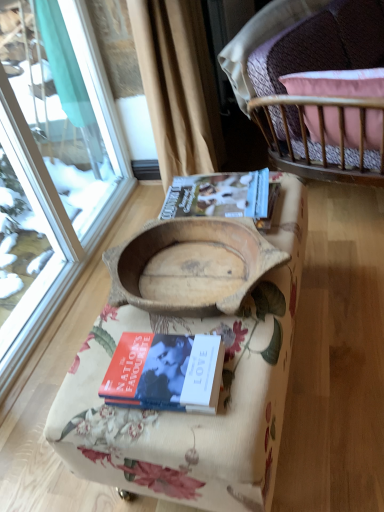
What is the approximate height of wooden cradle at center?

3.04 inches.

What is the approximate width of wooden bowl at center?

It is 17.95 inches.

This screenshot has height=512, width=384. What do you see at coordinates (165, 372) in the screenshot?
I see `hardcover book at center, the first book in the front-to-back sequence` at bounding box center [165, 372].

Image resolution: width=384 pixels, height=512 pixels. Identify the location of wooden cradle at center. (188, 241).

Who is more distant, wooden cradle at center or matte brown book at center, acting as the first book starting from the top?

matte brown book at center, acting as the first book starting from the top, is further from the camera.

Based on the photo, would you say wooden cradle at center is to the left or to the right of matte brown book at center, positioned as the 2th book in front-to-back order, in the picture?

From the image, it's evident that wooden cradle at center is to the left of matte brown book at center, positioned as the 2th book in front-to-back order.

Does wooden cradle at center have a larger size compared to matte brown book at center, which ranks as the 1th book in back-to-front order?

Yes.

Find the location of a particular element. The image size is (384, 512). infant bed behind the hardcover book at center, which is the first book from bottom to top is located at coordinates (188, 241).

Is hardcover book at center, which is the first book from bottom to top, wider or thinner than wooden cradle at center?

hardcover book at center, which is the first book from bottom to top, is thinner than wooden cradle at center.

From the image's perspective, which is below, hardcover book at center, the first book in the front-to-back sequence, or wooden cradle at center?

hardcover book at center, the first book in the front-to-back sequence, appears lower in the image.

Which of these two, wooden cradle at center or hardcover book at center, marked as the 2th book in a top-to-bottom arrangement, is smaller?

hardcover book at center, marked as the 2th book in a top-to-bottom arrangement, is smaller.

Is wooden cradle at center in contact with hardcover book at center, the first book in the front-to-back sequence?

wooden cradle at center and hardcover book at center, the first book in the front-to-back sequence, are clearly separated.

From a real-world perspective, which object rests below the other?

In real-world perspective, hardcover book at center, which is the first book from bottom to top, is lower.

Is wooden cradle at center outside of hardcover book at center, arranged as the second book when viewed from the back?

wooden cradle at center lies outside hardcover book at center, arranged as the second book when viewed from the back,'s area.

From the image's perspective, which object appears higher, matte brown book at center, which ranks as the 1th book in back-to-front order, or wooden cradle at center?

matte brown book at center, which ranks as the 1th book in back-to-front order, appears higher in the image.

Between matte brown book at center, acting as the first book starting from the top, and wooden cradle at center, which one has larger size?

Bigger between the two is wooden cradle at center.

Would you say wooden cradle at center is part of matte brown book at center, which ranks as the 1th book in back-to-front order,'s contents?

Definitely not — wooden cradle at center is not inside matte brown book at center, which ranks as the 1th book in back-to-front order.

Could you tell me if matte brown book at center, arranged as the second book when ordered from the bottom, is turned towards wooden cradle at center?

No, matte brown book at center, arranged as the second book when ordered from the bottom, is not facing towards wooden cradle at center.

From a real-world perspective, who is located higher, beige fabric curtain at upper center or wooden bowl at center?

From a 3D spatial view, beige fabric curtain at upper center is above.

Is beige fabric curtain at upper center positioned with its back to wooden bowl at center?

beige fabric curtain at upper center is not turned away from wooden bowl at center.

Based on the photo, can you confirm if beige fabric curtain at upper center is smaller than wooden bowl at center?

Indeed, beige fabric curtain at upper center has a smaller size compared to wooden bowl at center.

Which of these two, beige fabric curtain at upper center or wooden bowl at center, is wider?

wooden bowl at center is wider.

Based on the photo, from the image's perspective, does beige fabric curtain at upper center appear lower than wooden cradle at center?

Actually, beige fabric curtain at upper center appears above wooden cradle at center in the image.

Which of these two, beige fabric curtain at upper center or wooden cradle at center, is thinner?

beige fabric curtain at upper center is thinner.

Considering the relative sizes of beige fabric curtain at upper center and wooden cradle at center in the image provided, is beige fabric curtain at upper center shorter than wooden cradle at center?

No.

Could you tell me if beige fabric curtain at upper center is turned towards wooden cradle at center?

No, beige fabric curtain at upper center is not turned towards wooden cradle at center.

Is matte brown book at center, acting as the first book starting from the top, facing away from hardcover book at center, the first book in the front-to-back sequence?

matte brown book at center, acting as the first book starting from the top, does not have its back to hardcover book at center, the first book in the front-to-back sequence.

From the image's perspective, which one is positioned higher, matte brown book at center, arranged as the second book when ordered from the bottom, or hardcover book at center, which is the first book from bottom to top?

matte brown book at center, arranged as the second book when ordered from the bottom, from the image's perspective.

Measure the distance from matte brown book at center, arranged as the second book when ordered from the bottom, to hardcover book at center, the first book in the front-to-back sequence.

matte brown book at center, arranged as the second book when ordered from the bottom, is 20.35 inches from hardcover book at center, the first book in the front-to-back sequence.

From the picture: Is matte brown book at center, positioned as the 2th book in front-to-back order, closer to the viewer compared to hardcover book at center, the first book in the front-to-back sequence?

That is False.

The width and height of the screenshot is (384, 512). Find the location of `infant bed on the left of matte brown book at center, arranged as the second book when ordered from the bottom`. infant bed on the left of matte brown book at center, arranged as the second book when ordered from the bottom is located at coordinates (188, 241).

Locate an element on the screen. book that appears in front of the wooden cradle at center is located at coordinates (165, 372).

From the image, which object appears to be farther from beige fabric curtain at upper center, matte brown book at center, which ranks as the 1th book in back-to-front order, or hardcover book at center, marked as the 2th book in a top-to-bottom arrangement?

Based on the image, hardcover book at center, marked as the 2th book in a top-to-bottom arrangement, appears to be further to beige fabric curtain at upper center.

Based on their spatial positions, is pink fabric cushion at upper right or beige fabric curtain at upper center further from wooden bowl at center?

Among the two, beige fabric curtain at upper center is located further to wooden bowl at center.

Which object lies nearer to the anchor point wooden cradle at center, beige fabric curtain at upper center or hardcover book at center, arranged as the second book when viewed from the back?

hardcover book at center, arranged as the second book when viewed from the back, is closer to wooden cradle at center.

Looking at the image, which one is located closer to wooden bowl at center, wooden cradle at center or beige fabric curtain at upper center?

wooden cradle at center lies closer to wooden bowl at center than the other object.

Based on their spatial positions, is wooden cradle at center or pink fabric cushion at upper right closer to hardcover book at center, marked as the 2th book in a top-to-bottom arrangement?

wooden cradle at center lies closer to hardcover book at center, marked as the 2th book in a top-to-bottom arrangement, than the other object.

From the image, which object appears to be nearer to hardcover book at center, arranged as the second book when viewed from the back, matte brown book at center, positioned as the 2th book in front-to-back order, or wooden cradle at center?

wooden cradle at center is positioned closer to the anchor hardcover book at center, arranged as the second book when viewed from the back.

Based on their spatial positions, is matte brown book at center, arranged as the second book when ordered from the bottom, or wooden bowl at center further from wooden cradle at center?

The object further to wooden cradle at center is matte brown book at center, arranged as the second book when ordered from the bottom.

Estimate the real-world distances between objects in this image. Which object is closer to pink fabric cushion at upper right, hardcover book at center, marked as the 2th book in a top-to-bottom arrangement, or wooden bowl at center?

The object closer to pink fabric cushion at upper right is wooden bowl at center.

Locate an element on the screen. infant bed between pink fabric cushion at upper right and wooden bowl at center in the vertical direction is located at coordinates (188, 241).

Image resolution: width=384 pixels, height=512 pixels. What are the coordinates of `book between beige fabric curtain at upper center and wooden cradle at center vertically` in the screenshot? It's located at (218, 196).

Locate an element on the screen. book that lies between beige fabric curtain at upper center and wooden bowl at center from top to bottom is located at coordinates (218, 196).

At what (x,y) coordinates should I click in order to perform the action: click on book between wooden cradle at center and pink fabric cushion at upper right in the horizontal direction. Please return your answer as a coordinate pair (x, y). The image size is (384, 512). Looking at the image, I should click on (218, 196).